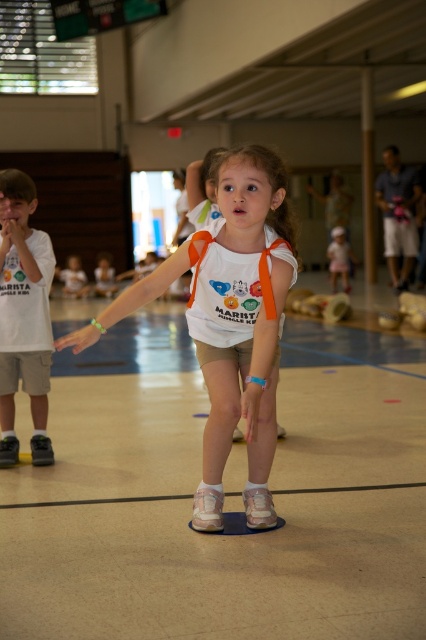
Question: Which is nearer to the pink fabric dress at center?

Choices:
 (A) matte white shirt at left
 (B) white matte tank top at center

Answer: (A)

Question: Which object appears farthest from the camera in this image?

Choices:
 (A) pink fabric dress at center
 (B) matte white shirt at left

Answer: (A)

Question: Is white matte tank top at center smaller than pink fabric dress at center?

Choices:
 (A) yes
 (B) no

Answer: (B)

Question: Observing the image, what is the correct spatial positioning of white matte tank top at center in reference to pink fabric dress at center?

Choices:
 (A) above
 (B) below

Answer: (B)

Question: Which of the following is the closest to the observer?

Choices:
 (A) white matte tank top at center
 (B) pink fabric dress at center
 (C) matte white shirt at left

Answer: (A)

Question: Can you confirm if matte white shirt at left is positioned to the right of pink fabric dress at center?

Choices:
 (A) yes
 (B) no

Answer: (B)